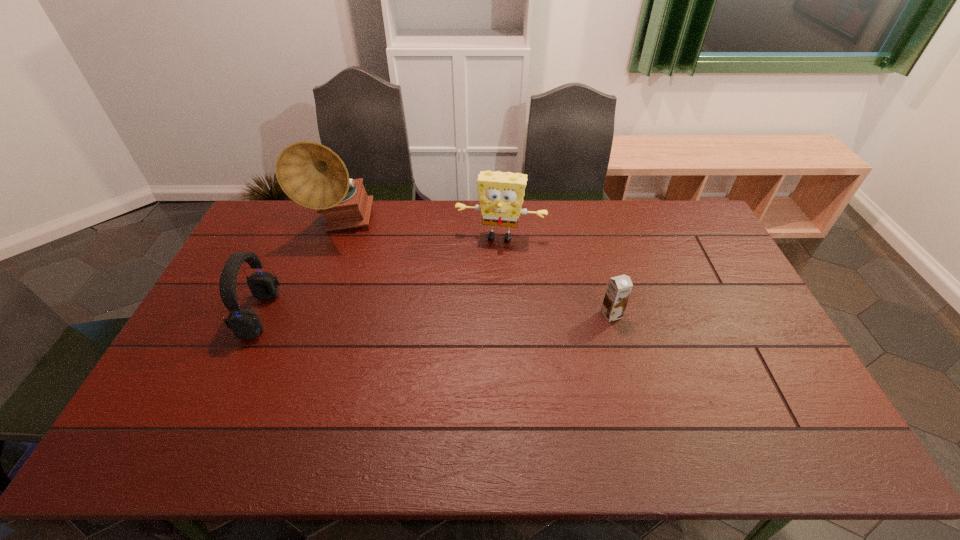
Locate an element on the screen. vacant space located on the face of the sponge is located at coordinates (479, 336).

This screenshot has width=960, height=540. In order to click on free space located 0.350m on the face of the sponge in this screenshot , I will do `click(481, 326)`.

You are a GUI agent. You are given a task and a screenshot of the screen. Output one action in this format:
    pyautogui.click(x=<x>, y=<y>)
    Task: Click on the vacant space located 0.260m on the face of the sponge
    This screenshot has width=960, height=540.
    Given the screenshot: What is the action you would take?
    pyautogui.click(x=485, y=303)

Find the location of `phonograph record at the far edge`. phonograph record at the far edge is located at coordinates (311, 174).

Identify the location of sponge at the far edge. (501, 194).

The image size is (960, 540). What are the coordinates of `object that is at the left edge` in the screenshot? It's located at (245, 324).

This screenshot has width=960, height=540. In order to click on vacant space at the far edge in this screenshot , I will do `click(593, 224)`.

Identify the location of vacant area at the near edge. (418, 411).

Where is `blank space at the left edge of the desktop`? This screenshot has height=540, width=960. blank space at the left edge of the desktop is located at coordinates (238, 275).

This screenshot has height=540, width=960. In the image, there is a desktop. What are the coordinates of `vacant area at the right edge` in the screenshot? It's located at (732, 376).